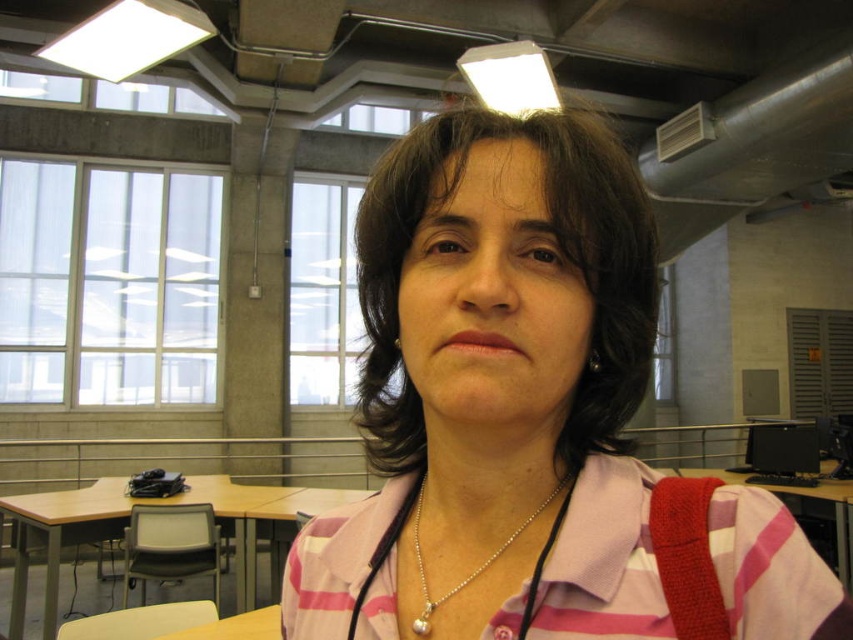
Is wooden table at right above silver metallic necklace at center?

Incorrect, wooden table at right is not positioned above silver metallic necklace at center.

Who is shorter, wooden table at right or silver metallic necklace at center?

Standing shorter between the two is silver metallic necklace at center.

Does point (842, 481) lie in front of point (550, 492)?

No.

The width and height of the screenshot is (853, 640). What are the coordinates of `wooden table at right` in the screenshot? It's located at (827, 516).

Measure the distance between pink striped shirt at center and camera.

The distance of pink striped shirt at center from camera is 12.40 inches.

Which is in front, point (509, 320) or point (827, 493)?

Point (509, 320) is more forward.

Identify the location of pink striped shirt at center. Image resolution: width=853 pixels, height=640 pixels. (527, 417).

Can you confirm if pink striped shirt at center is thinner than silver metallic necklace at center?

No.

What do you see at coordinates (527, 417) in the screenshot? The image size is (853, 640). I see `pink striped shirt at center` at bounding box center [527, 417].

Which is behind, point (564, 444) or point (430, 625)?

The point (564, 444) is more distant.

Locate an element on the screen. pink striped shirt at center is located at coordinates (527, 417).